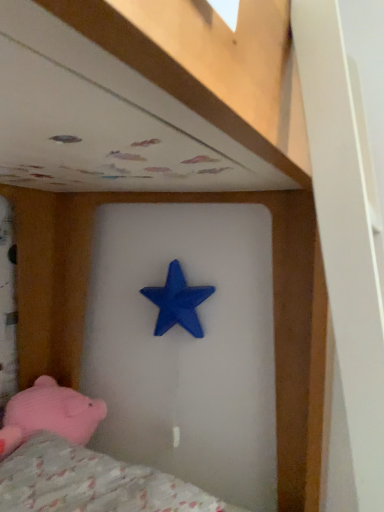
Question: Is fluffy pink fabric at lower left wider or thinner than blue matte star at center?

Choices:
 (A) thin
 (B) wide

Answer: (B)

Question: Considering the positions of fluffy pink fabric at lower left and blue matte star at center in the image, is fluffy pink fabric at lower left bigger or smaller than blue matte star at center?

Choices:
 (A) small
 (B) big

Answer: (B)

Question: Estimate the real-world distances between objects in this image. Which object is closer to the fluffy pink fabric at lower left?

Choices:
 (A) blue matte star at center
 (B) pink plush pig at lower left

Answer: (B)

Question: Estimate the real-world distances between objects in this image. Which object is farther from the blue matte star at center?

Choices:
 (A) fluffy pink fabric at lower left
 (B) pink plush pig at lower left

Answer: (A)